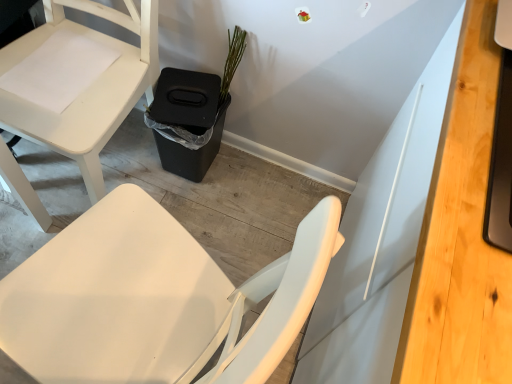
Question: Does white matte chair at lower left touch light wood desk at right?

Choices:
 (A) yes
 (B) no

Answer: (B)

Question: From the image's perspective, is white matte chair at lower left above light wood desk at right?

Choices:
 (A) yes
 (B) no

Answer: (A)

Question: From the image's perspective, would you say white matte chair at lower left is shown under light wood desk at right?

Choices:
 (A) yes
 (B) no

Answer: (B)

Question: Is the depth of white matte chair at lower left greater than that of light wood desk at right?

Choices:
 (A) no
 (B) yes

Answer: (B)

Question: Is white matte chair at lower left not close to light wood desk at right?

Choices:
 (A) yes
 (B) no

Answer: (B)

Question: Considering their positions, is light wood desk at right located in front of or behind white matte chair at lower left?

Choices:
 (A) behind
 (B) front

Answer: (B)

Question: Is light wood desk at right bigger or smaller than white matte chair at lower left?

Choices:
 (A) big
 (B) small

Answer: (B)

Question: Visually, is light wood desk at right positioned to the left or to the right of white matte chair at lower left?

Choices:
 (A) left
 (B) right

Answer: (B)

Question: Is light wood desk at right situated inside white matte chair at lower left or outside?

Choices:
 (A) inside
 (B) outside

Answer: (B)

Question: From the image's perspective, is black plastic trash bin at lower center positioned above or below light wood desk at right?

Choices:
 (A) above
 (B) below

Answer: (A)

Question: Is point (184, 172) closer or farther from the camera than point (441, 241)?

Choices:
 (A) closer
 (B) farther

Answer: (B)

Question: Which is correct: black plastic trash bin at lower center is inside light wood desk at right, or outside of it?

Choices:
 (A) outside
 (B) inside

Answer: (A)

Question: Relative to light wood desk at right, is black plastic trash bin at lower center in front or behind?

Choices:
 (A) front
 (B) behind

Answer: (B)

Question: Is point pyautogui.click(x=238, y=59) positioned closer to the camera than point pyautogui.click(x=88, y=170)?

Choices:
 (A) farther
 (B) closer

Answer: (A)

Question: Considering the positions of green matte plant at upper center and white matte chair at lower left in the image, is green matte plant at upper center wider or thinner than white matte chair at lower left?

Choices:
 (A) wide
 (B) thin

Answer: (B)